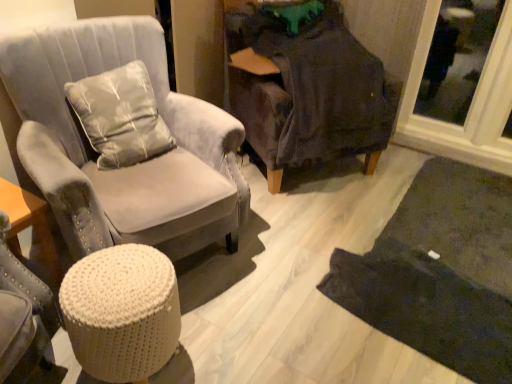
Question: Considering the relative positions of satin-like gray pillow at upper left and dark gray fabric chair at center, acting as the second chair starting from the left, in the image provided, is satin-like gray pillow at upper left to the left of dark gray fabric chair at center, acting as the second chair starting from the left, from the viewer's perspective?

Choices:
 (A) no
 (B) yes

Answer: (B)

Question: Is satin-like gray pillow at upper left oriented away from dark gray fabric chair at center, marked as the 1th chair in a right-to-left arrangement?

Choices:
 (A) yes
 (B) no

Answer: (B)

Question: Is satin-like gray pillow at upper left placed right next to dark gray fabric chair at center, marked as the 1th chair in a right-to-left arrangement?

Choices:
 (A) yes
 (B) no

Answer: (B)

Question: Is satin-like gray pillow at upper left smaller than dark gray fabric chair at center, marked as the 1th chair in a right-to-left arrangement?

Choices:
 (A) yes
 (B) no

Answer: (A)

Question: Considering the relative sizes of satin-like gray pillow at upper left and dark gray fabric chair at center, marked as the 1th chair in a right-to-left arrangement, in the image provided, is satin-like gray pillow at upper left taller than dark gray fabric chair at center, marked as the 1th chair in a right-to-left arrangement,?

Choices:
 (A) yes
 (B) no

Answer: (B)

Question: Choose the correct answer: Is white knitted stool at lower left inside suede gray armchair at left, which is the 2th chair in right-to-left order, or outside it?

Choices:
 (A) inside
 (B) outside

Answer: (B)

Question: In terms of size, does white knitted stool at lower left appear bigger or smaller than suede gray armchair at left, which is the 2th chair in right-to-left order?

Choices:
 (A) small
 (B) big

Answer: (A)

Question: Considering the positions of point (101, 367) and point (119, 61), is point (101, 367) closer or farther from the camera than point (119, 61)?

Choices:
 (A) farther
 (B) closer

Answer: (B)

Question: In the image, is white knitted stool at lower left on the left side or the right side of suede gray armchair at left, which is the 2th chair in right-to-left order?

Choices:
 (A) right
 (B) left

Answer: (A)

Question: In terms of size, does satin-like gray pillow at upper left appear bigger or smaller than dark gray fabric chair at center, acting as the second chair starting from the left?

Choices:
 (A) big
 (B) small

Answer: (B)

Question: Is satin-like gray pillow at upper left spatially inside dark gray fabric chair at center, acting as the second chair starting from the left, or outside of it?

Choices:
 (A) outside
 (B) inside

Answer: (A)

Question: From the image's perspective, is satin-like gray pillow at upper left positioned above or below dark gray fabric chair at center, marked as the 1th chair in a right-to-left arrangement?

Choices:
 (A) above
 (B) below

Answer: (B)

Question: Considering the relative positions of satin-like gray pillow at upper left and dark gray fabric chair at center, marked as the 1th chair in a right-to-left arrangement, in the image provided, is satin-like gray pillow at upper left to the left or to the right of dark gray fabric chair at center, marked as the 1th chair in a right-to-left arrangement,?

Choices:
 (A) right
 (B) left

Answer: (B)

Question: From a real-world perspective, is dark gray fabric chair at center, acting as the second chair starting from the left, positioned above or below satin-like gray pillow at upper left?

Choices:
 (A) below
 (B) above

Answer: (A)

Question: In the image, is dark gray fabric chair at center, acting as the second chair starting from the left, on the left side or the right side of satin-like gray pillow at upper left?

Choices:
 (A) right
 (B) left

Answer: (A)